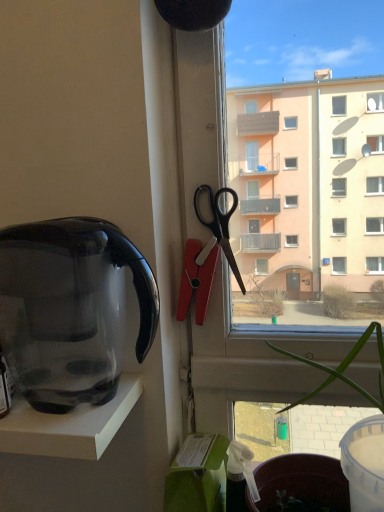
Question: Is green leafy plant at center touching black plastic scissors at upper right?

Choices:
 (A) yes
 (B) no

Answer: (B)

Question: Is green leafy plant at center looking in the opposite direction of black plastic scissors at upper right?

Choices:
 (A) no
 (B) yes

Answer: (A)

Question: Does green leafy plant at center have a greater height compared to black plastic scissors at upper right?

Choices:
 (A) yes
 (B) no

Answer: (A)

Question: From a real-world perspective, does green leafy plant at center stand above black plastic scissors at upper right?

Choices:
 (A) yes
 (B) no

Answer: (B)

Question: Is green leafy plant at center at the left side of black plastic scissors at upper right?

Choices:
 (A) no
 (B) yes

Answer: (A)

Question: In the image, is black plastic scissors at upper right positioned in front of or behind green leafy plant at center?

Choices:
 (A) front
 (B) behind

Answer: (B)

Question: Is black plastic scissors at upper right taller or shorter than green leafy plant at center?

Choices:
 (A) tall
 (B) short

Answer: (B)

Question: From a real-world perspective, relative to green leafy plant at center, is black plastic scissors at upper right vertically above or below?

Choices:
 (A) below
 (B) above

Answer: (B)

Question: In the image, is black plastic scissors at upper right on the left side or the right side of green leafy plant at center?

Choices:
 (A) right
 (B) left

Answer: (B)

Question: Is point (304, 360) positioned closer to the camera than point (3, 293)?

Choices:
 (A) farther
 (B) closer

Answer: (A)

Question: Is green leafy plant at center inside the boundaries of transparent plastic kettle at left, or outside?

Choices:
 (A) outside
 (B) inside

Answer: (A)

Question: Based on their sizes in the image, would you say green leafy plant at center is bigger or smaller than transparent plastic kettle at left?

Choices:
 (A) big
 (B) small

Answer: (A)

Question: Relative to transparent plastic kettle at left, is green leafy plant at center in front or behind?

Choices:
 (A) front
 (B) behind

Answer: (A)

Question: In the image, is transparent plastic kettle at left positioned in front of or behind black plastic scissors at upper right?

Choices:
 (A) behind
 (B) front

Answer: (B)

Question: Considering the positions of transparent plastic kettle at left and black plastic scissors at upper right in the image, is transparent plastic kettle at left wider or thinner than black plastic scissors at upper right?

Choices:
 (A) wide
 (B) thin

Answer: (A)